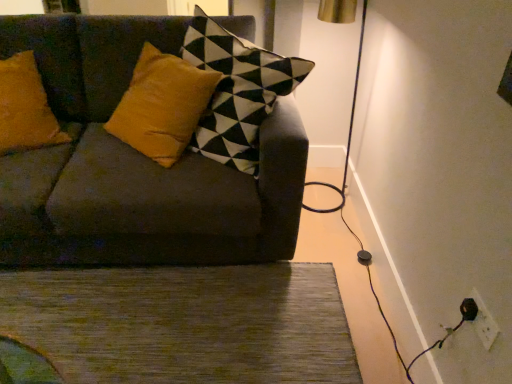
Question: Is white plastic electric outlet at lower right at the left side of green textured rug at lower center?

Choices:
 (A) no
 (B) yes

Answer: (A)

Question: Is white plastic electric outlet at lower right behind green textured rug at lower center?

Choices:
 (A) no
 (B) yes

Answer: (A)

Question: Are white plastic electric outlet at lower right and green textured rug at lower center located far from each other?

Choices:
 (A) no
 (B) yes

Answer: (B)

Question: Is white plastic electric outlet at lower right next to green textured rug at lower center?

Choices:
 (A) no
 (B) yes

Answer: (A)

Question: From the image's perspective, is white plastic electric outlet at lower right beneath green textured rug at lower center?

Choices:
 (A) no
 (B) yes

Answer: (A)

Question: Is white plastic electric outlet at lower right completely or partially outside of green textured rug at lower center?

Choices:
 (A) no
 (B) yes

Answer: (B)

Question: Is green textured rug at lower center a part of velvet dark gray couch at center?

Choices:
 (A) no
 (B) yes

Answer: (A)

Question: Does velvet dark gray couch at center have a smaller size compared to green textured rug at lower center?

Choices:
 (A) yes
 (B) no

Answer: (B)

Question: Does velvet dark gray couch at center lie behind green textured rug at lower center?

Choices:
 (A) yes
 (B) no

Answer: (B)

Question: Does velvet dark gray couch at center have a lesser height compared to green textured rug at lower center?

Choices:
 (A) no
 (B) yes

Answer: (A)

Question: From a real-world perspective, is velvet dark gray couch at center on green textured rug at lower center?

Choices:
 (A) yes
 (B) no

Answer: (A)

Question: Does velvet dark gray couch at center have a greater height compared to green textured rug at lower center?

Choices:
 (A) no
 (B) yes

Answer: (B)

Question: Is white plastic electric outlet at lower right taller than velvet dark gray couch at center?

Choices:
 (A) no
 (B) yes

Answer: (A)